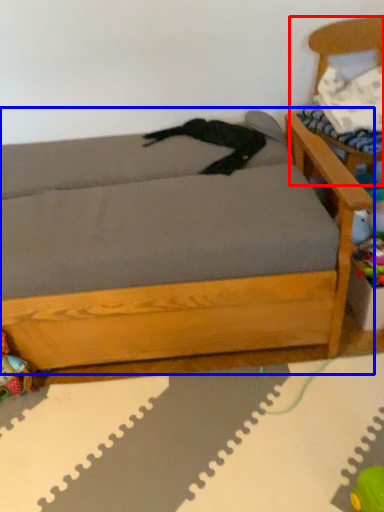
Question: Which object is further to the camera taking this photo, armchair (highlighted by a red box) or studio couch (highlighted by a blue box)?

Choices:
 (A) armchair
 (B) studio couch

Answer: (A)